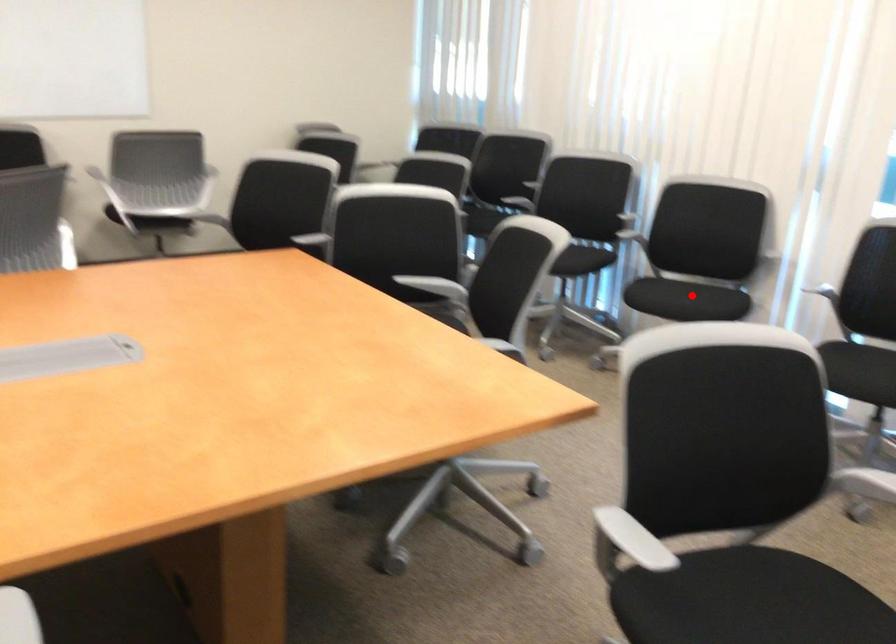
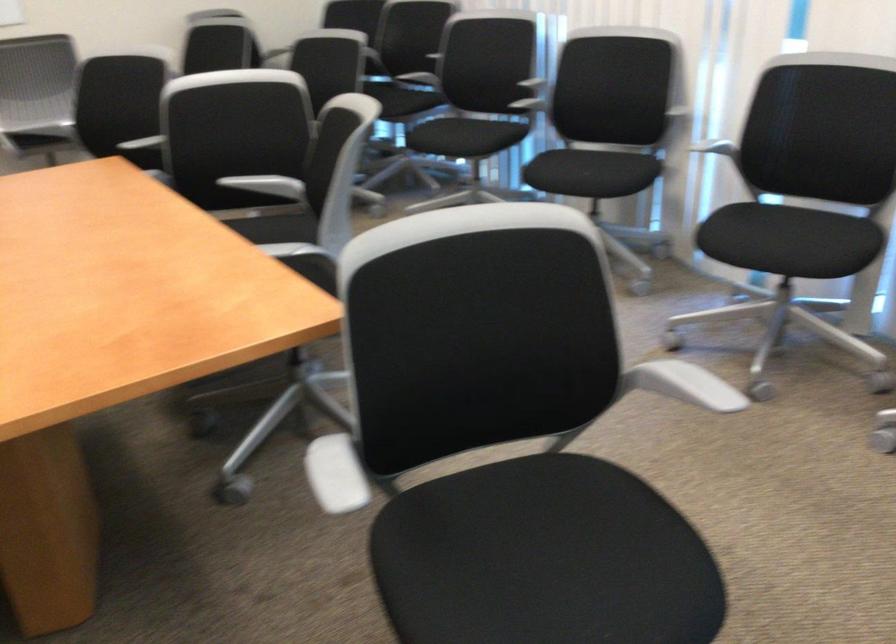
The point at the highlighted location is marked in the first image. Where is the corresponding point in the second image?

(587, 174)